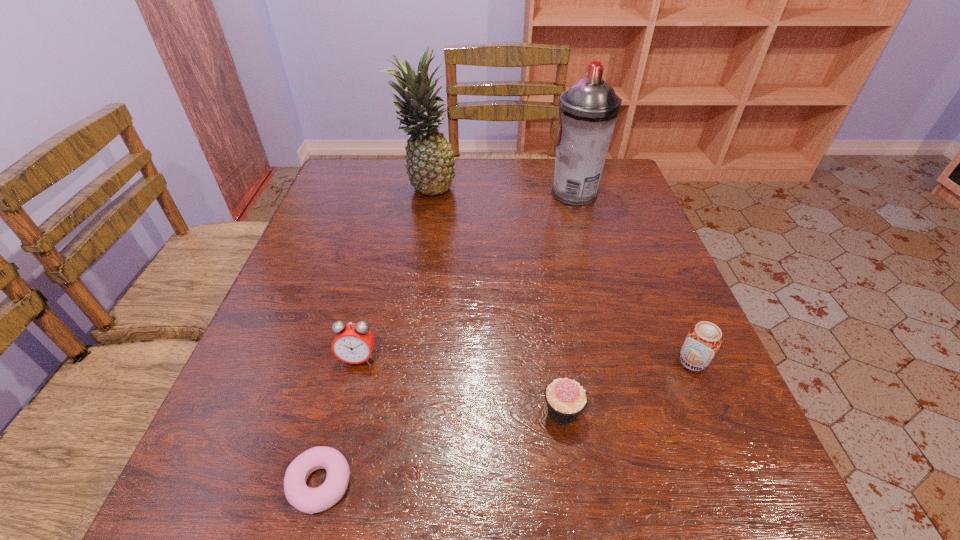
The height and width of the screenshot is (540, 960). Identify the location of free space that satisfies the following two spatial constraints: 1. on the back side of the pastry; 2. on the left side of the second object from right to left. (396, 193).

Where is `vacant area that satisfies the following two spatial constraints: 1. on the front side of the fifth object from left to right; 2. on the right side of the rightmost object`? The height and width of the screenshot is (540, 960). vacant area that satisfies the following two spatial constraints: 1. on the front side of the fifth object from left to right; 2. on the right side of the rightmost object is located at coordinates (624, 362).

The image size is (960, 540). Find the location of `blank area in the image that satisfies the following two spatial constraints: 1. on the front side of the rightmost object; 2. on the right side of the aerosol can`. blank area in the image that satisfies the following two spatial constraints: 1. on the front side of the rightmost object; 2. on the right side of the aerosol can is located at coordinates (624, 362).

Identify the location of vacant space that satisfies the following two spatial constraints: 1. on the front-facing side of the second nearest object; 2. on the left side of the alarm clock. (346, 411).